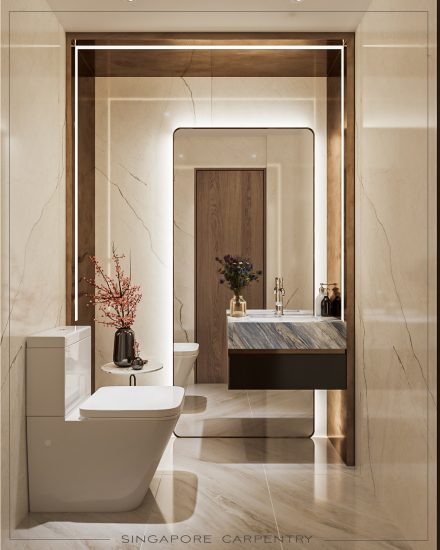
Locate an element on the screen. Image resolution: width=440 pixels, height=550 pixels. soap dispenser is located at coordinates (327, 304).